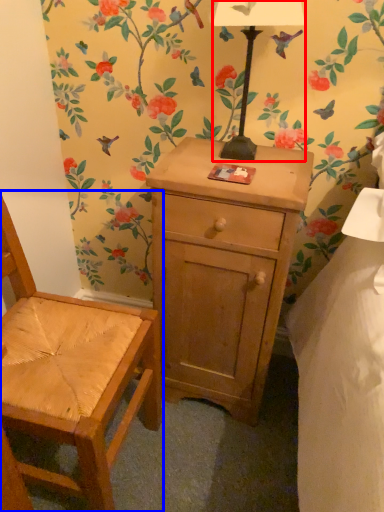
Question: Which object is further to the camera taking this photo, lamp (highlighted by a red box) or chair (highlighted by a blue box)?

Choices:
 (A) lamp
 (B) chair

Answer: (A)